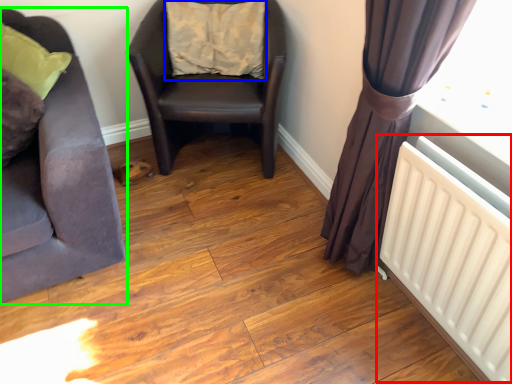
Question: Which object is positioned farthest from radiator (highlighted by a red box)? Select from pillow (highlighted by a blue box) and chair (highlighted by a green box).

Choices:
 (A) pillow
 (B) chair

Answer: (A)